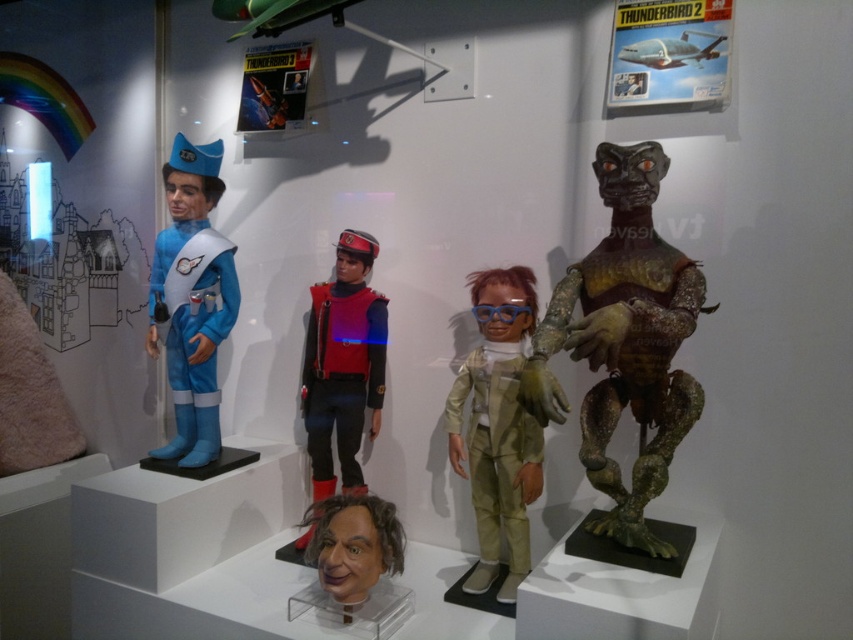
You are organizing a display and need to place the light brown fabric doll at center and the smooth plastic mask at center. According to the scene, which object is placed above the other?

The light brown fabric doll at center is positioned over the smooth plastic mask at center, so the doll is above the mask.

Which figure is positioned at the coordinates point (192, 300)?

The matte blue plastic figure at left is positioned at point (192, 300).